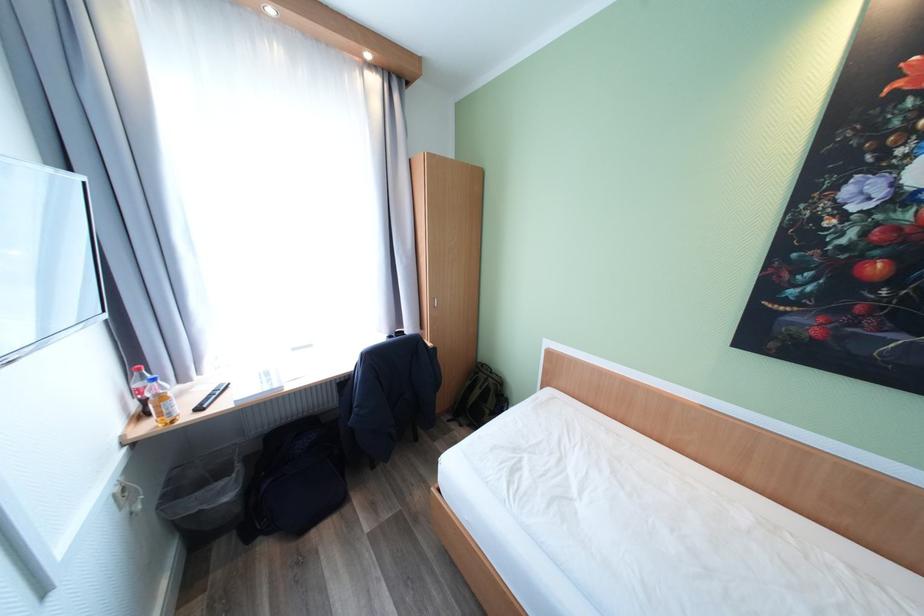
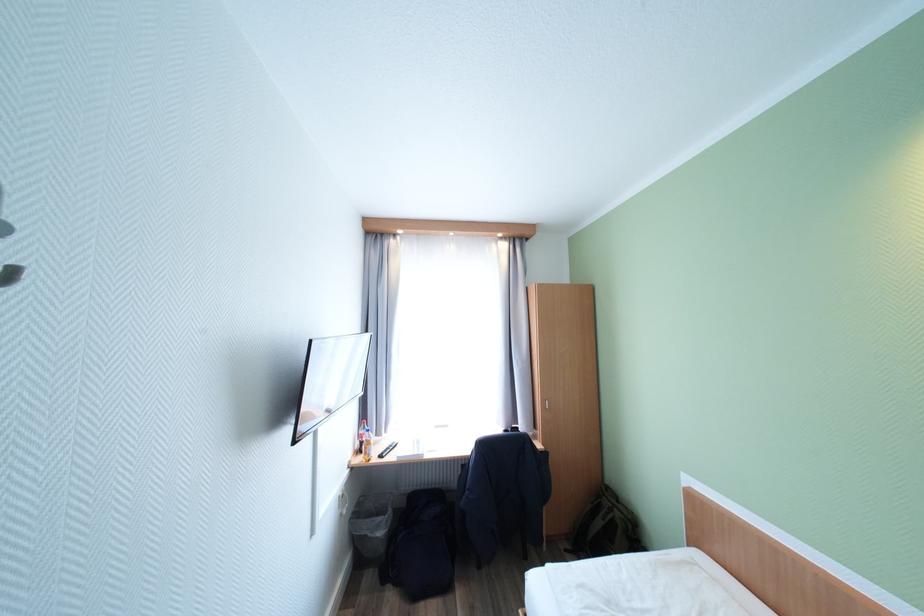
The point at (442,300) is marked in the first image. Where is the corresponding point in the second image?

(553, 402)